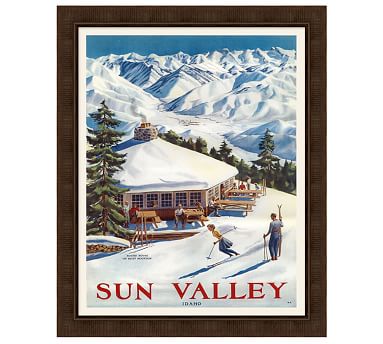
Where is `brown textured frame`? The height and width of the screenshot is (344, 383). brown textured frame is located at coordinates coord(67,14), coord(317,15), coord(315,325), coord(67,326).